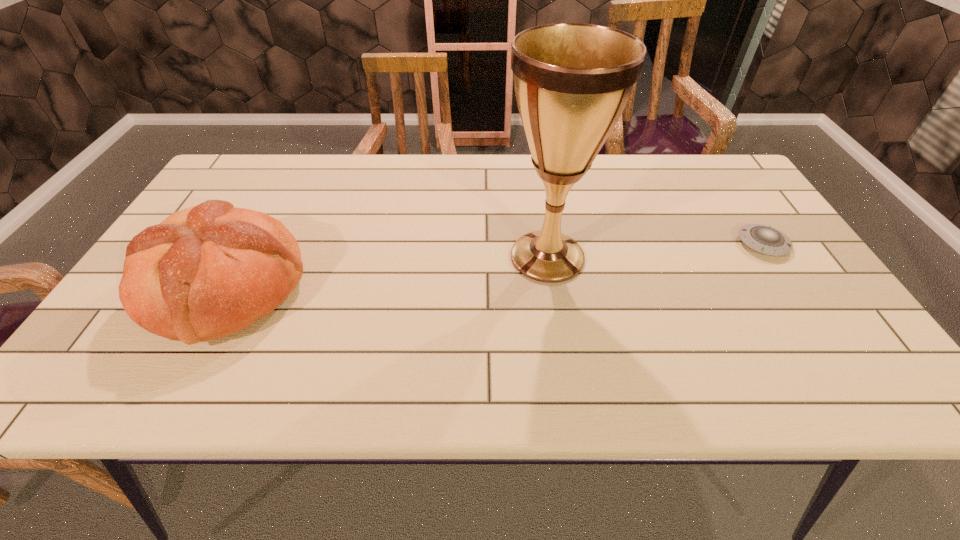
What are the coordinates of `object located in the right edge section of the desktop` in the screenshot? It's located at (764, 239).

At what (x,y) coordinates should I click in order to perform the action: click on vacant region at the far edge. Please return your answer as a coordinate pair (x, y). This screenshot has height=540, width=960. Looking at the image, I should click on [x=477, y=186].

Identify the location of free space at the near edge of the desktop. The image size is (960, 540). (539, 384).

This screenshot has height=540, width=960. Find the location of `blank area at the right edge`. blank area at the right edge is located at coordinates (778, 292).

Identify the location of vacant space at the far left corner of the desktop. This screenshot has width=960, height=540. (227, 198).

Identify the location of vacant space at the near left corner of the desktop. This screenshot has width=960, height=540. (148, 360).

I want to click on vacant space at the far right corner of the desktop, so click(726, 177).

This screenshot has width=960, height=540. In order to click on blank region between the bread and the second object from left to right in this screenshot , I will do pyautogui.click(x=387, y=273).

You are a GUI agent. You are given a task and a screenshot of the screen. Output one action in this format:
    pyautogui.click(x=<x>, y=<y>)
    Task: Click on the vacant area that lies between the leftmost object and the rightmost object
    This screenshot has width=960, height=540.
    Given the screenshot: What is the action you would take?
    pyautogui.click(x=494, y=266)

In order to click on free space between the tallest object and the saucer in this screenshot , I will do `click(655, 251)`.